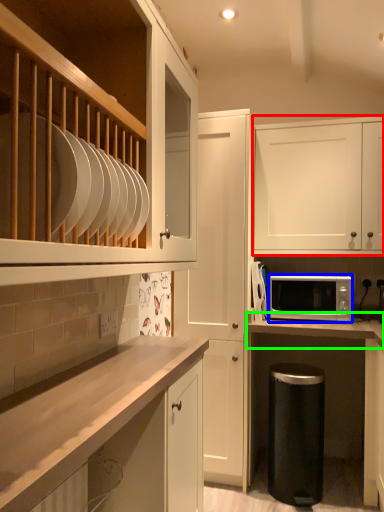
Question: Estimate the real-world distances between objects in this image. Which object is closer to cabinetry (highlighted by a red box), microwave oven (highlighted by a blue box) or countertop (highlighted by a green box)?

Choices:
 (A) microwave oven
 (B) countertop

Answer: (A)